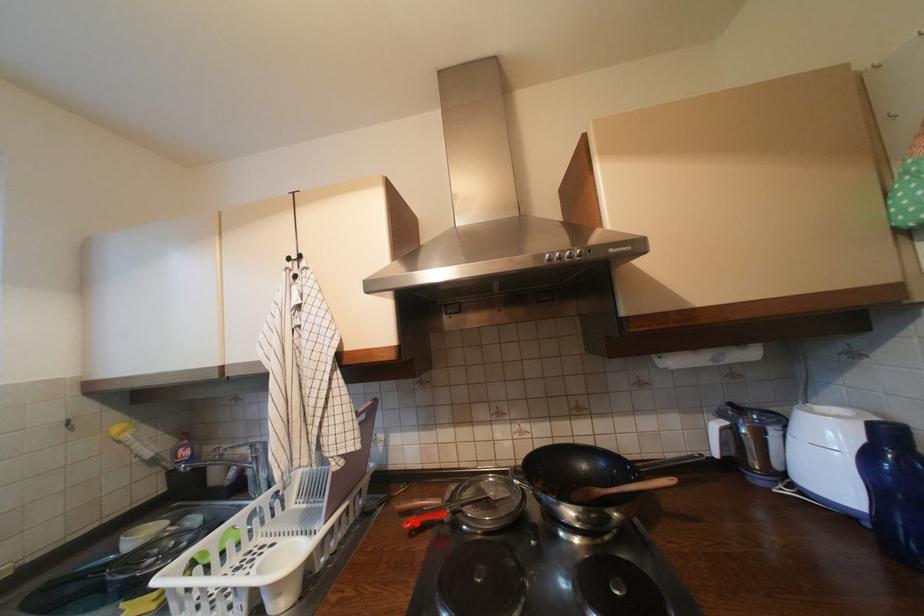
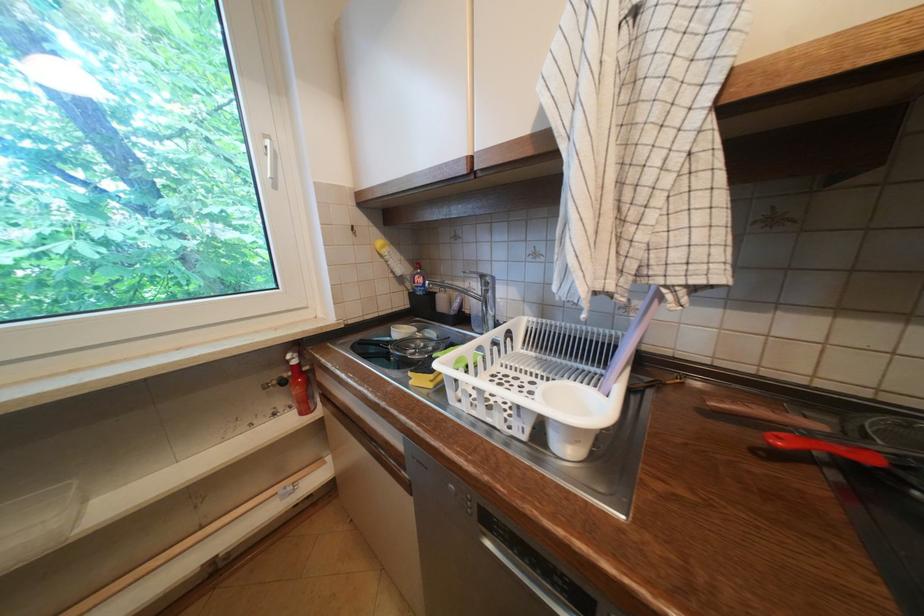
The point at the highlighted location is marked in the first image. Where is the corresponding point in the second image?

(788, 440)